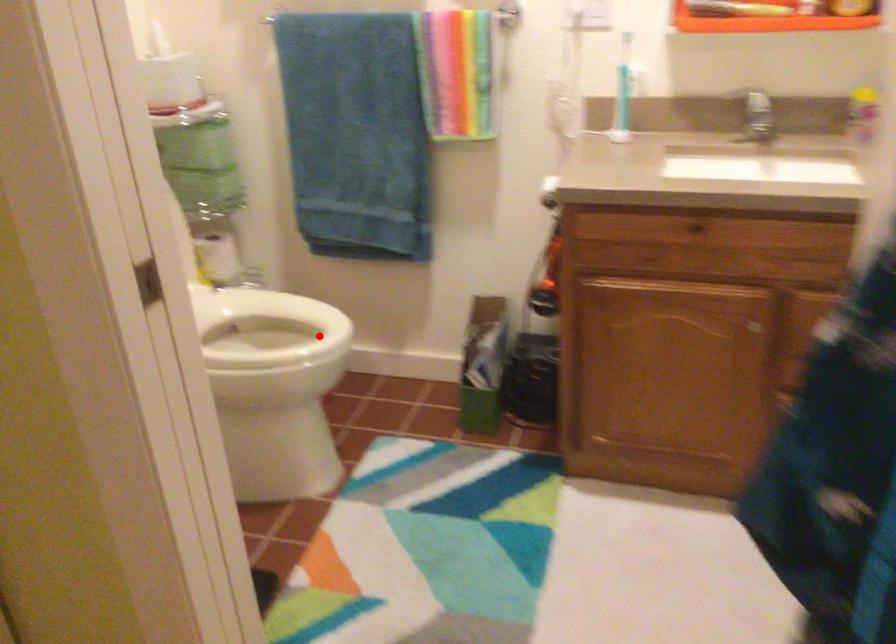
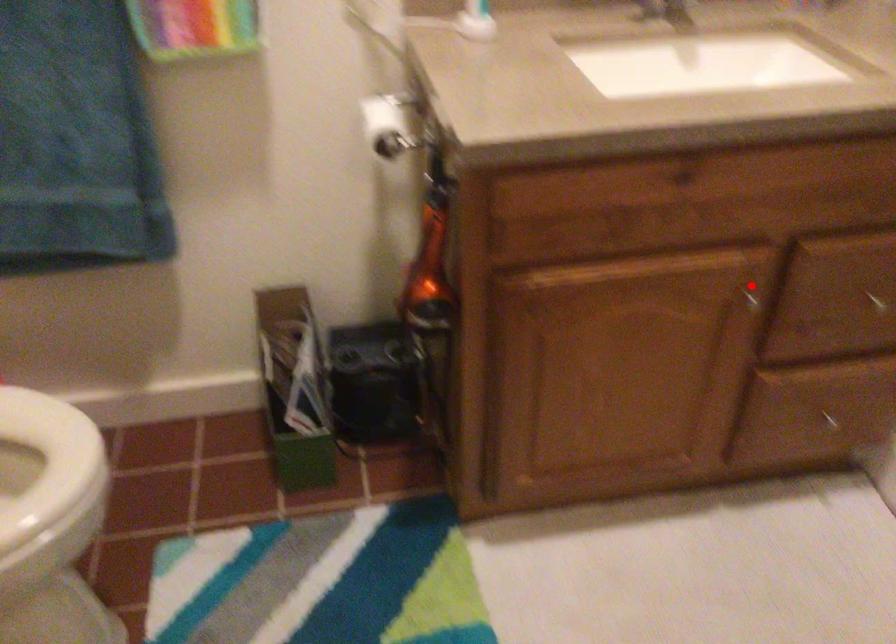
I am providing you with two images of the same scene from different viewpoints. A red point is marked on the first image and another point is marked on the second image. Are the points marked in image1 and image2 representing the same 3D position?

No